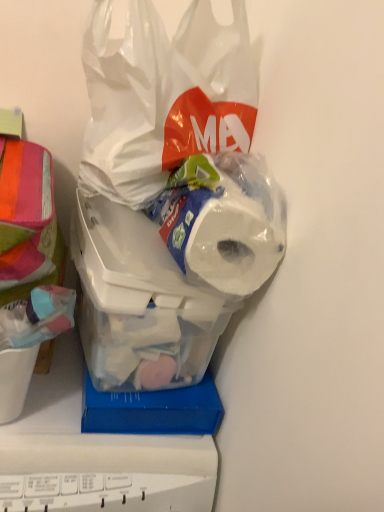
Question: Is multicolored fabric at left next to white matte toilet paper at center?

Choices:
 (A) yes
 (B) no

Answer: (B)

Question: Is multicolored fabric at left facing towards white matte toilet paper at center?

Choices:
 (A) yes
 (B) no

Answer: (B)

Question: From the image's perspective, is multicolored fabric at left beneath white matte toilet paper at center?

Choices:
 (A) no
 (B) yes

Answer: (B)

Question: Is multicolored fabric at left thinner than white matte toilet paper at center?

Choices:
 (A) yes
 (B) no

Answer: (B)

Question: From a real-world perspective, is multicolored fabric at left positioned over white matte toilet paper at center based on gravity?

Choices:
 (A) no
 (B) yes

Answer: (A)

Question: In terms of width, does translucent plastic container at center look wider or thinner when compared to transparent plastic bag at upper center?

Choices:
 (A) thin
 (B) wide

Answer: (B)

Question: From the image's perspective, is translucent plastic container at center located above or below transparent plastic bag at upper center?

Choices:
 (A) above
 (B) below

Answer: (B)

Question: Considering the positions of point (228, 306) and point (87, 169), is point (228, 306) closer or farther from the camera than point (87, 169)?

Choices:
 (A) closer
 (B) farther

Answer: (A)

Question: Is translucent plastic container at center in front of or behind transparent plastic bag at upper center in the image?

Choices:
 (A) behind
 (B) front

Answer: (A)

Question: Is transparent plastic bag at upper center taller or shorter than white matte toilet paper at center?

Choices:
 (A) tall
 (B) short

Answer: (A)

Question: From a real-world perspective, is transparent plastic bag at upper center physically located above or below white matte toilet paper at center?

Choices:
 (A) above
 (B) below

Answer: (A)

Question: Based on their positions, is transparent plastic bag at upper center located to the left or right of white matte toilet paper at center?

Choices:
 (A) right
 (B) left

Answer: (B)

Question: Is transparent plastic bag at upper center in front of or behind white matte toilet paper at center in the image?

Choices:
 (A) front
 (B) behind

Answer: (A)

Question: Is transparent plastic bag at upper center wider or thinner than translucent plastic container at center?

Choices:
 (A) wide
 (B) thin

Answer: (B)

Question: From the image's perspective, is transparent plastic bag at upper center above or below translucent plastic container at center?

Choices:
 (A) above
 (B) below

Answer: (A)